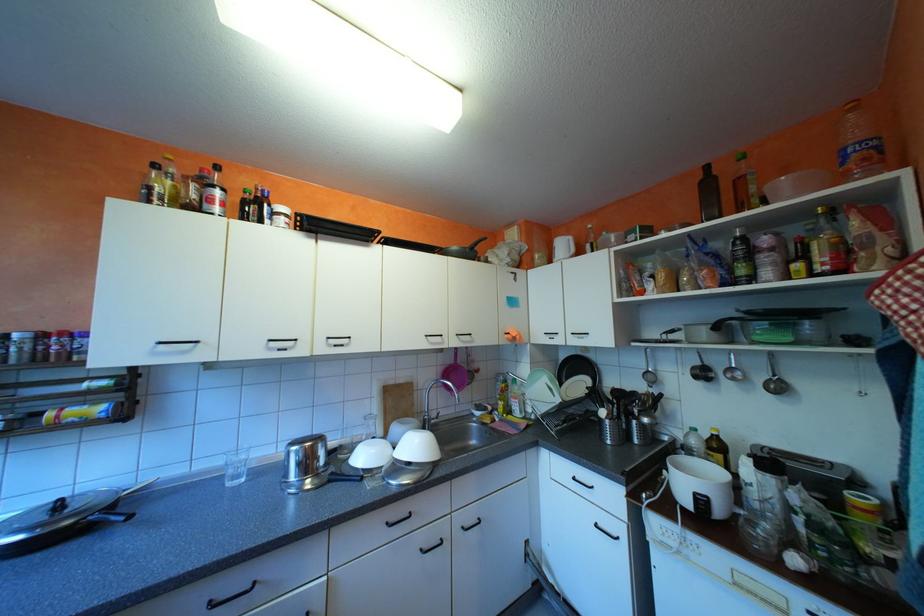
In order to click on faucet handle in this screenshot , I will do `click(430, 419)`.